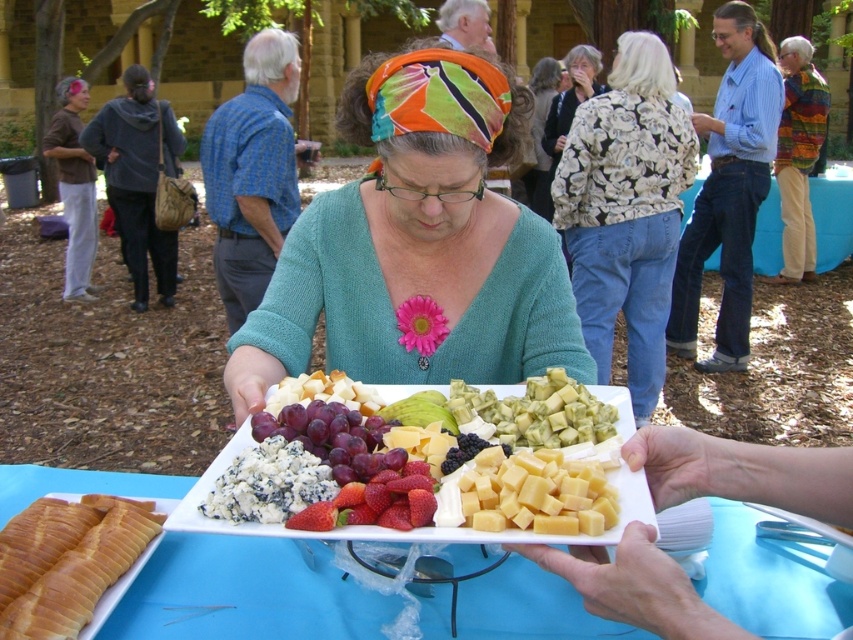
How much distance is there between yellow hard cheese at center and ripe red strawberries at center?

They are 3.44 inches apart.

Is yellow hard cheese at center positioned at the back of ripe red strawberries at center?

No.

Is point (529, 476) behind point (407, 520)?

That is True.

This screenshot has width=853, height=640. I want to click on yellow hard cheese at center, so click(x=537, y=493).

Is point (33, 548) closer to camera compared to point (277, 428)?

No, (33, 548) is further to viewer.

Which is behind, point (32, 573) or point (355, 461)?

Point (32, 573)

Who is more distant from viewer, (x=56, y=602) or (x=381, y=422)?

The point (x=381, y=422) is more distant.

You are a GUI agent. You are given a task and a screenshot of the screen. Output one action in this format:
    pyautogui.click(x=<x>, y=<y>)
    Task: Click on the sliced golden bread at lower left
    The image size is (853, 640).
    Given the screenshot: What is the action you would take?
    pyautogui.click(x=67, y=561)

Is floral-patterned jacket at center thinner than white cheese at center?

In fact, floral-patterned jacket at center might be wider than white cheese at center.

Is floral-patterned jacket at center smaller than white cheese at center?

Incorrect, floral-patterned jacket at center is not smaller in size than white cheese at center.

Between point (695, 163) and point (206, 483), which one is positioned behind?

The point (695, 163) is more distant.

Where is `floral-patterned jacket at center`? floral-patterned jacket at center is located at coordinates (625, 211).